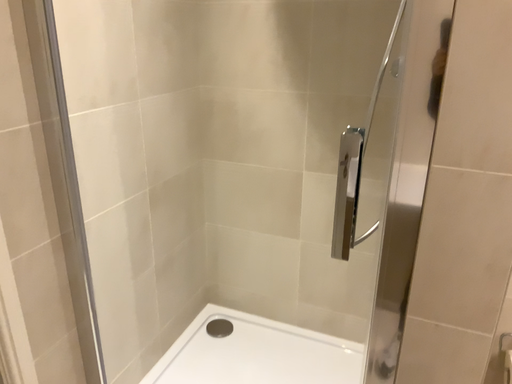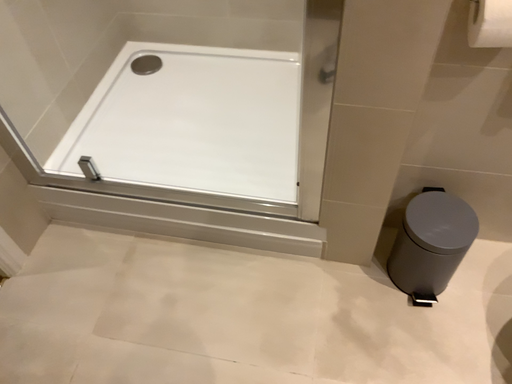
Question: Which way did the camera rotate in the video?

Choices:
 (A) rotated downward
 (B) rotated upward

Answer: (A)